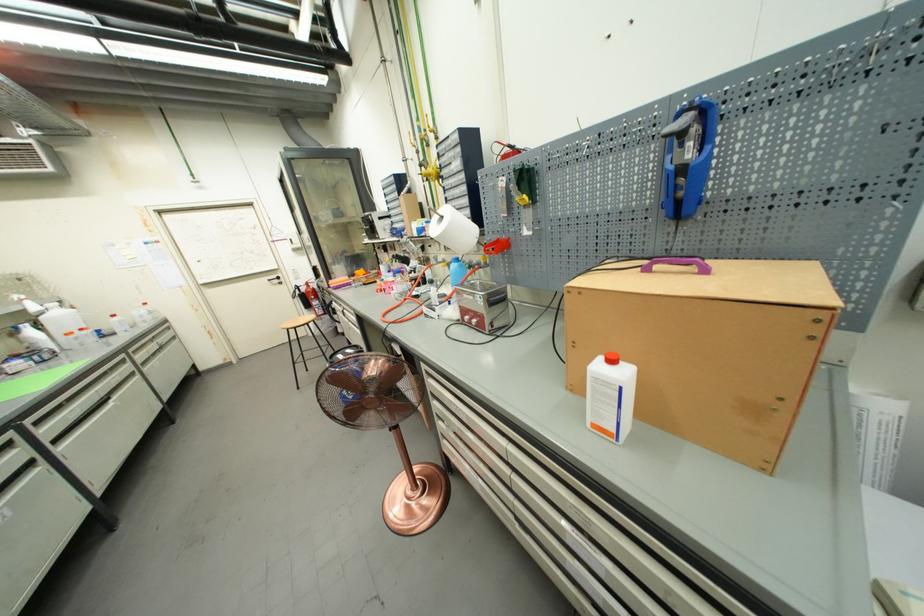
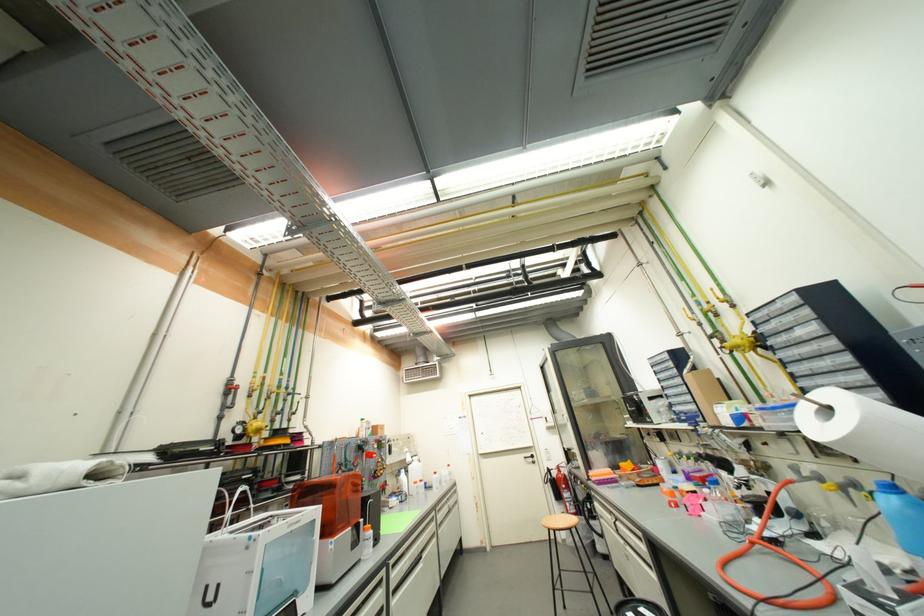
Where in the second image is the point corresponding to (x=447, y=219) from the first image?

(833, 410)